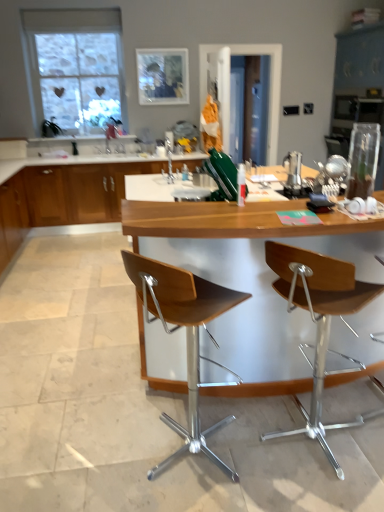
Question: From the image's perspective, would you say wooden cabinet at center is positioned over wooden seat at right, the 2th chair from the left?

Choices:
 (A) yes
 (B) no

Answer: (A)

Question: From the image's perspective, is wooden cabinet at center beneath wooden seat at right, the 1th chair in the right-to-left sequence?

Choices:
 (A) no
 (B) yes

Answer: (A)

Question: Can you confirm if wooden cabinet at center is smaller than wooden seat at right, the 2th chair from the left?

Choices:
 (A) yes
 (B) no

Answer: (B)

Question: From a real-world perspective, does wooden cabinet at center sit lower than wooden seat at right, the 2th chair from the left?

Choices:
 (A) no
 (B) yes

Answer: (B)

Question: Is wooden cabinet at center facing away from wooden seat at right, the 2th chair from the left?

Choices:
 (A) no
 (B) yes

Answer: (A)

Question: In terms of height, does woodenmaterial/texturetable at center look taller or shorter compared to clear glass window at upper left?

Choices:
 (A) short
 (B) tall

Answer: (A)

Question: In terms of size, does woodenmaterial/texturetable at center appear bigger or smaller than clear glass window at upper left?

Choices:
 (A) big
 (B) small

Answer: (A)

Question: From the image's perspective, is woodenmaterial/texturetable at center positioned above or below clear glass window at upper left?

Choices:
 (A) above
 (B) below

Answer: (B)

Question: In terms of width, does woodenmaterial/texturetable at center look wider or thinner when compared to clear glass window at upper left?

Choices:
 (A) wide
 (B) thin

Answer: (A)

Question: Which is correct: wooden seat at center, arranged as the second chair when viewed from the right, is inside wooden seat at right, the 1th chair in the right-to-left sequence, or outside of it?

Choices:
 (A) outside
 (B) inside

Answer: (A)

Question: Considering the positions of wooden seat at center, arranged as the second chair when viewed from the right, and wooden seat at right, the 1th chair in the right-to-left sequence, in the image, is wooden seat at center, arranged as the second chair when viewed from the right, taller or shorter than wooden seat at right, the 1th chair in the right-to-left sequence,?

Choices:
 (A) short
 (B) tall

Answer: (B)

Question: Looking at their shapes, would you say wooden seat at center, the first chair viewed from the left, is wider or thinner than wooden seat at right, the 2th chair from the left?

Choices:
 (A) wide
 (B) thin

Answer: (A)

Question: Considering the positions of wooden seat at center, the first chair viewed from the left, and wooden seat at right, the 1th chair in the right-to-left sequence, in the image, is wooden seat at center, the first chair viewed from the left, bigger or smaller than wooden seat at right, the 1th chair in the right-to-left sequence,?

Choices:
 (A) small
 (B) big

Answer: (B)

Question: From a real-world perspective, is wooden cabinet at center positioned above or below wooden seat at right, the 1th chair in the right-to-left sequence?

Choices:
 (A) above
 (B) below

Answer: (B)

Question: Is wooden cabinet at center to the left or to the right of wooden seat at right, the 2th chair from the left, in the image?

Choices:
 (A) left
 (B) right

Answer: (A)